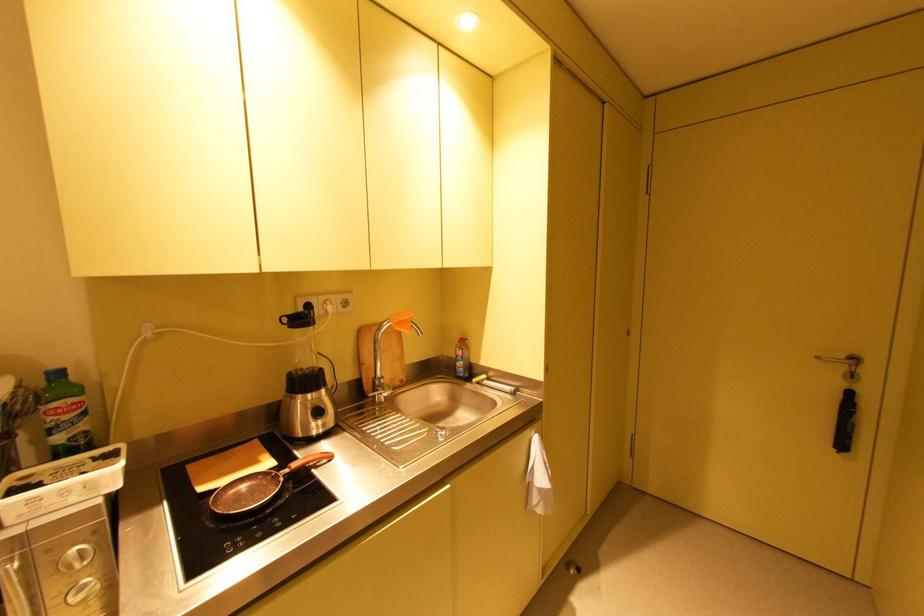
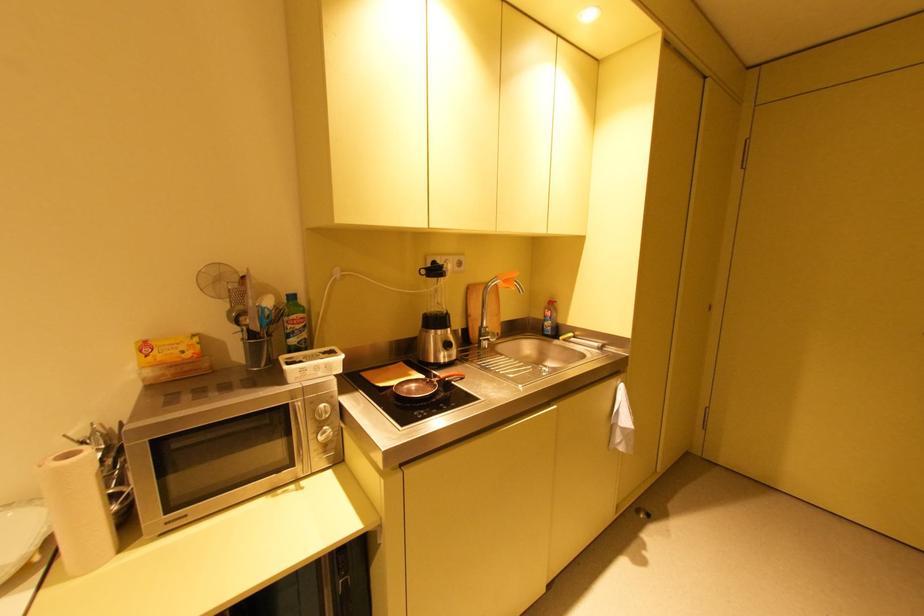
Find the pixel in the second image that matches (58,418) in the first image.

(296, 326)